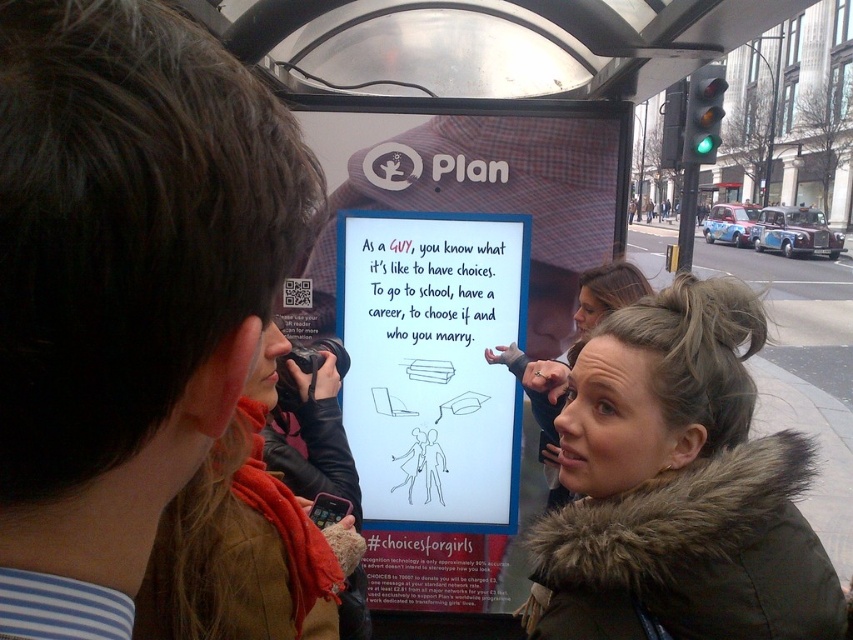
You are a person standing at the bus stop and you want to read the advertisement on the white paperboard at center. There is a brown fur coat at center in front of you. Can you see the advertisement clearly?

The brown fur coat at center is not as tall as the white paperboard at center, so the coat is shorter than the board. Since the coat is shorter, it might block part of the board but the top part of the board would still be visible. However, the exact visibility depends on the coat wearer standing position, but based on height difference alone, the top section remains viewable.